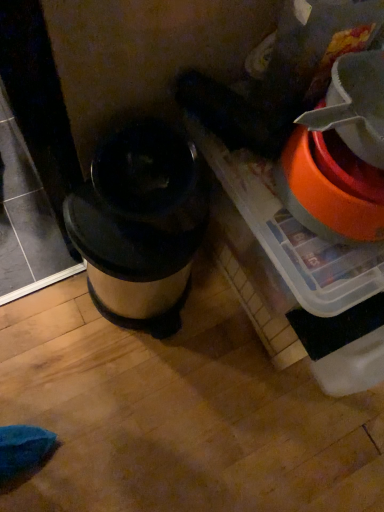
The image size is (384, 512). Find the location of `free space above metallic silver trash can at center (from a real-world perspective)`. free space above metallic silver trash can at center (from a real-world perspective) is located at coordinates (115, 230).